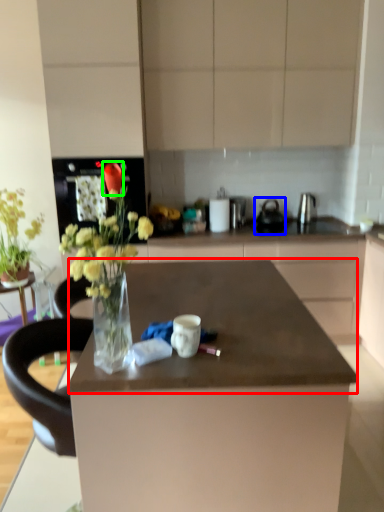
Question: Which is nearer to the countertop (highlighted by a red box)? appliance (highlighted by a blue box) or flower (highlighted by a green box).

Choices:
 (A) appliance
 (B) flower

Answer: (B)